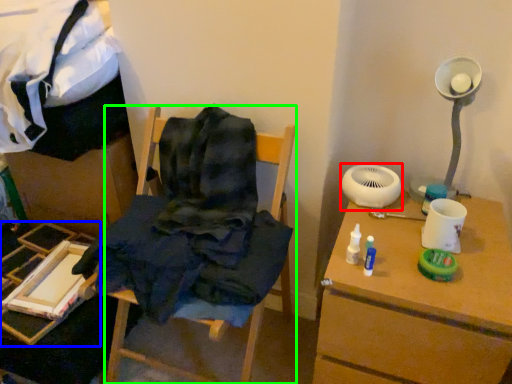
Question: Which object is the farthest from mechanical fan (highlighted by a red box)? Choose among these: furniture (highlighted by a blue box) or furniture (highlighted by a green box).

Choices:
 (A) furniture
 (B) furniture

Answer: (A)